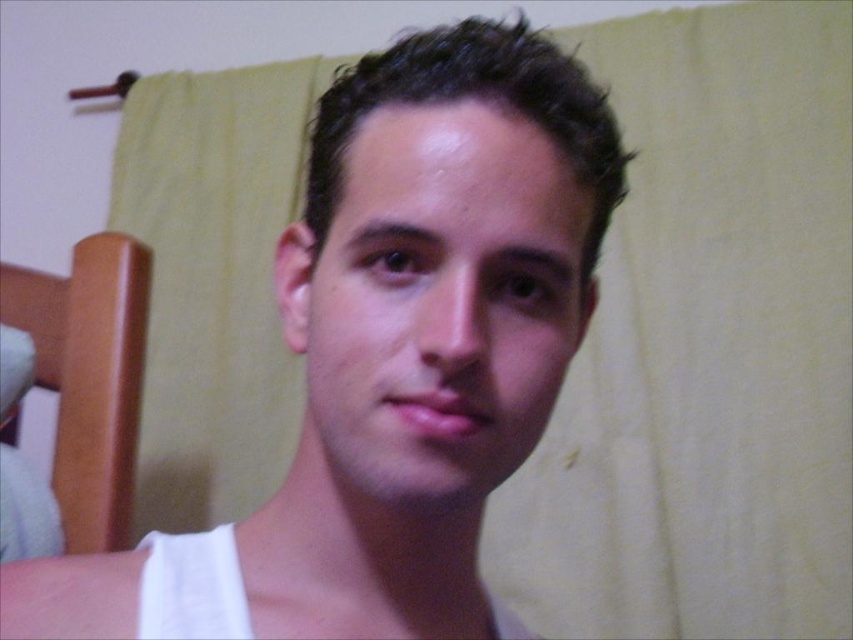
From the picture: You are designing a custom frame for a portrait. The frame needs to accommodate both the white matte tank top at center and the smooth skin face at center. Based on the image, which object requires a wider space in the frame?

The white matte tank top at center requires a wider space in the frame because its width surpasses that of the smooth skin face at center.

You are an artist sketching the scene. You need to draw the white matte tank top at center and the smooth skin face at center. Which object should you draw first if you start from the left side of the page?

The white matte tank top at center should be drawn first because it is located to the left of the smooth skin face at center.

You are a fashion designer observing the image. You need to decide which item, the white matte tank top at center or the smooth skin face at center, is positioned higher on the person. Based on the description, which one is taller?

The white matte tank top at center is taller than the smooth skin face at center, so the tank top is positioned higher.